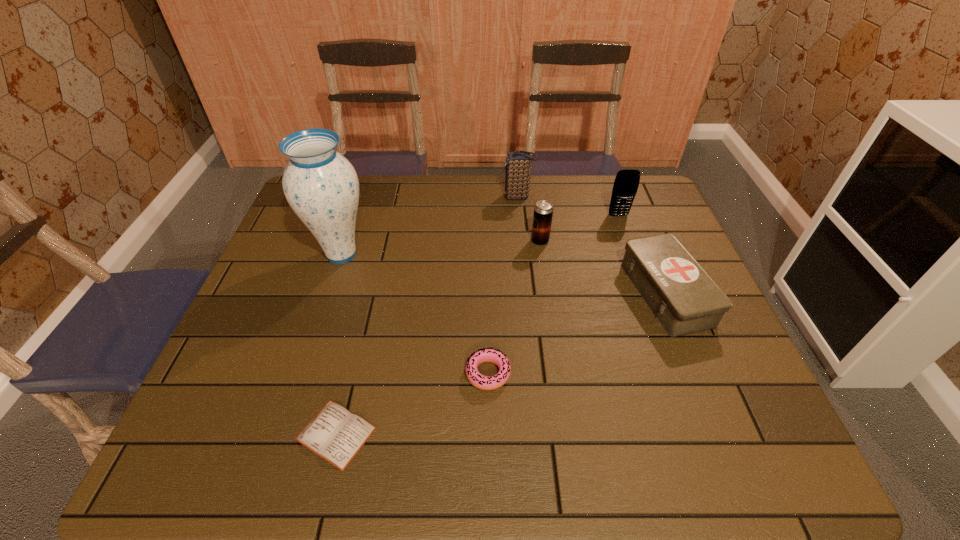
The image size is (960, 540). I want to click on object located in the near edge section of the desktop, so click(x=335, y=434).

Image resolution: width=960 pixels, height=540 pixels. Find the location of `object that is at the left edge`. object that is at the left edge is located at coordinates (321, 186).

The width and height of the screenshot is (960, 540). I want to click on cellular telephone that is positioned at the right edge, so click(626, 183).

Find the location of a particular element. the first-aid kit at the right edge is located at coordinates (683, 297).

Identify the location of object present at the far right corner. Image resolution: width=960 pixels, height=540 pixels. (626, 183).

The height and width of the screenshot is (540, 960). In the image, there is a desktop. Find the location of `free space at the far edge`. free space at the far edge is located at coordinates coord(569,179).

In the image, there is a desktop. Where is `vacant space at the near edge`? The width and height of the screenshot is (960, 540). vacant space at the near edge is located at coordinates (474, 474).

Where is `vacant space at the left edge of the desktop`? vacant space at the left edge of the desktop is located at coordinates (304, 259).

You are a GUI agent. You are given a task and a screenshot of the screen. Output one action in this format:
    pyautogui.click(x=<x>, y=<y>)
    Task: Click on the vacant space at the right edge of the desktop
    The height and width of the screenshot is (540, 960).
    Given the screenshot: What is the action you would take?
    pyautogui.click(x=626, y=221)

Where is `empty location between the first-aid kit and the tallest object`? empty location between the first-aid kit and the tallest object is located at coordinates (504, 274).